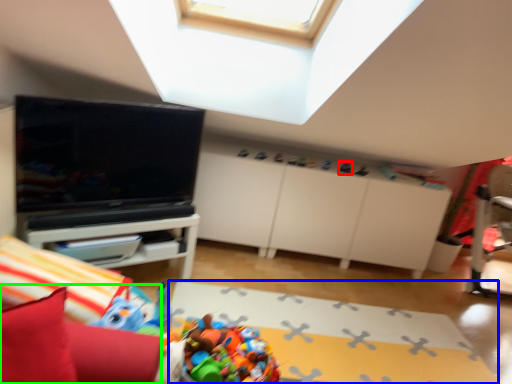
Question: Which object is the farthest from toy (highlighted by a red box)? Choose among these: plain (highlighted by a blue box) or bean bag chair (highlighted by a green box).

Choices:
 (A) plain
 (B) bean bag chair

Answer: (B)